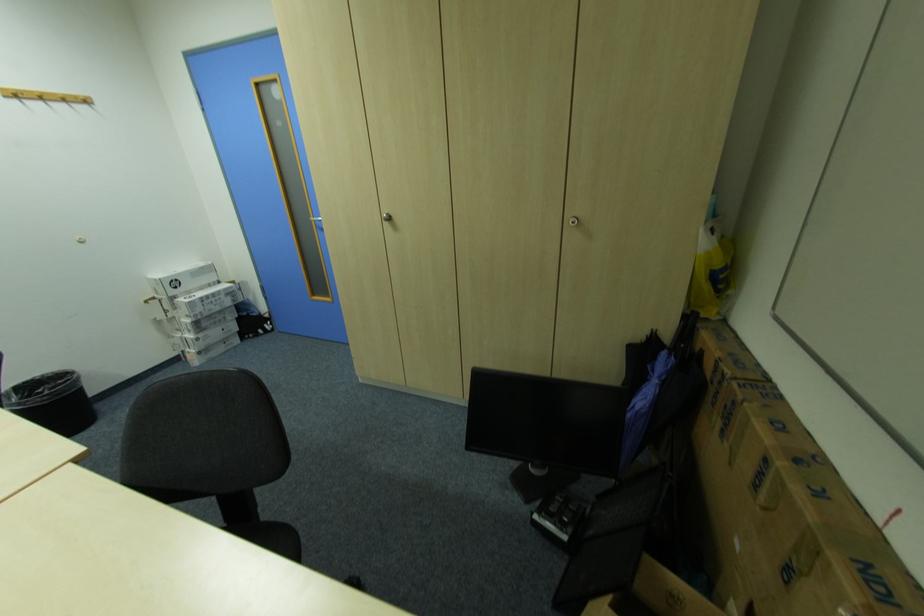
I want to click on closed black laptop, so click(545, 419).